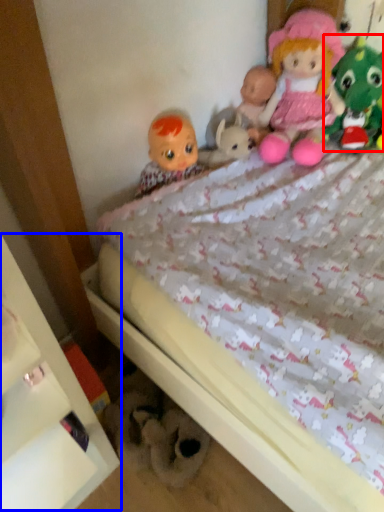
Question: Among these objects, which one is farthest to the camera, toy (highlighted by a red box) or shelf (highlighted by a blue box)?

Choices:
 (A) toy
 (B) shelf

Answer: (A)